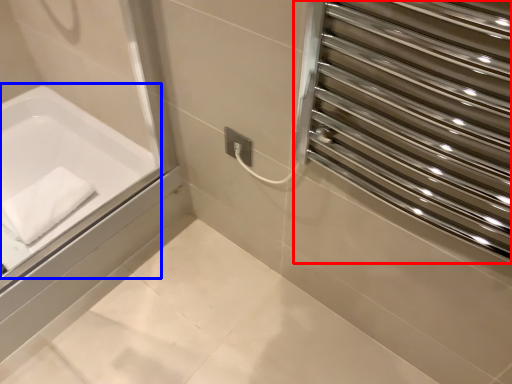
Question: Which point is closer to the camera, screen door (highlighted by a red box) or bathtub (highlighted by a blue box)?

Choices:
 (A) screen door
 (B) bathtub

Answer: (A)